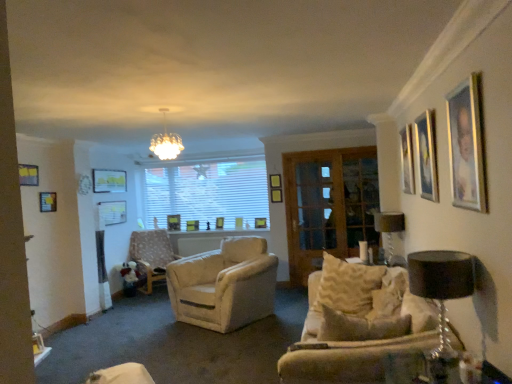
Question: Should I look upward or downward to see patterned fabric chair at center-left?

Choices:
 (A) up
 (B) down

Answer: (B)

Question: Is matte black lampshade at right, the second lamp positioned from the left, far away from wooden picture frame at center, the 11th picture frame positioned from the front?

Choices:
 (A) yes
 (B) no

Answer: (A)

Question: Can you see matte black lampshade at right, the 2th lamp viewed from the front, touching wooden picture frame at center, arranged as the 2th picture frame when viewed from the back?

Choices:
 (A) yes
 (B) no

Answer: (B)

Question: Is matte black lampshade at right, the second lamp positioned from the left, facing towards wooden picture frame at center, which ranks as the 7th picture frame in right-to-left order?

Choices:
 (A) yes
 (B) no

Answer: (B)

Question: From a real-world perspective, is matte black lampshade at right, acting as the first lamp starting from the right, positioned under wooden picture frame at center, which ranks as the 7th picture frame in right-to-left order, based on gravity?

Choices:
 (A) no
 (B) yes

Answer: (A)

Question: Is matte black lampshade at right, the first lamp in the back-to-front sequence, positioned before wooden picture frame at center, the 6th picture frame viewed from the left?

Choices:
 (A) no
 (B) yes

Answer: (B)

Question: Is matte black lampshade at right, the second lamp positioned from the left, shorter than wooden picture frame at center, which ranks as the 7th picture frame in right-to-left order?

Choices:
 (A) no
 (B) yes

Answer: (A)

Question: From the image's perspective, would you say white glass chandelier at upper center is positioned over matte gold picture frame at upper right, which is counted as the eleventh picture frame, starting from the back?

Choices:
 (A) yes
 (B) no

Answer: (A)

Question: Could you tell me if white glass chandelier at upper center is turned towards matte gold picture frame at upper right, which is counted as the eleventh picture frame, starting from the back?

Choices:
 (A) no
 (B) yes

Answer: (A)

Question: Does white glass chandelier at upper center lie behind matte gold picture frame at upper right, which is counted as the eleventh picture frame, starting from the back?

Choices:
 (A) yes
 (B) no

Answer: (A)

Question: Does white glass chandelier at upper center have a lesser height compared to matte gold picture frame at upper right, which is counted as the eleventh picture frame, starting from the back?

Choices:
 (A) yes
 (B) no

Answer: (A)

Question: Considering the relative positions of white glass chandelier at upper center and matte gold picture frame at upper right, placed as the 2th picture frame when sorted from front to back, in the image provided, is white glass chandelier at upper center to the right of matte gold picture frame at upper right, placed as the 2th picture frame when sorted from front to back, from the viewer's perspective?

Choices:
 (A) no
 (B) yes

Answer: (A)

Question: Is matte gold picture frame at upper right, which is counted as the eleventh picture frame, starting from the back, surrounded by white glass chandelier at upper center?

Choices:
 (A) yes
 (B) no

Answer: (B)

Question: Is white glass chandelier at upper center positioned before wooden picture frame at center, which appears as the 6th picture frame when viewed from the right?

Choices:
 (A) yes
 (B) no

Answer: (A)